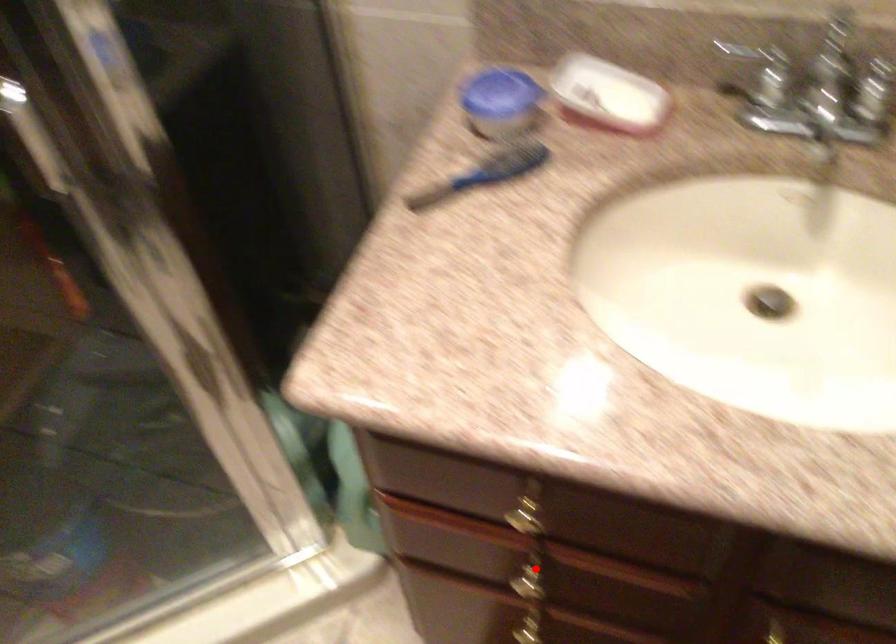
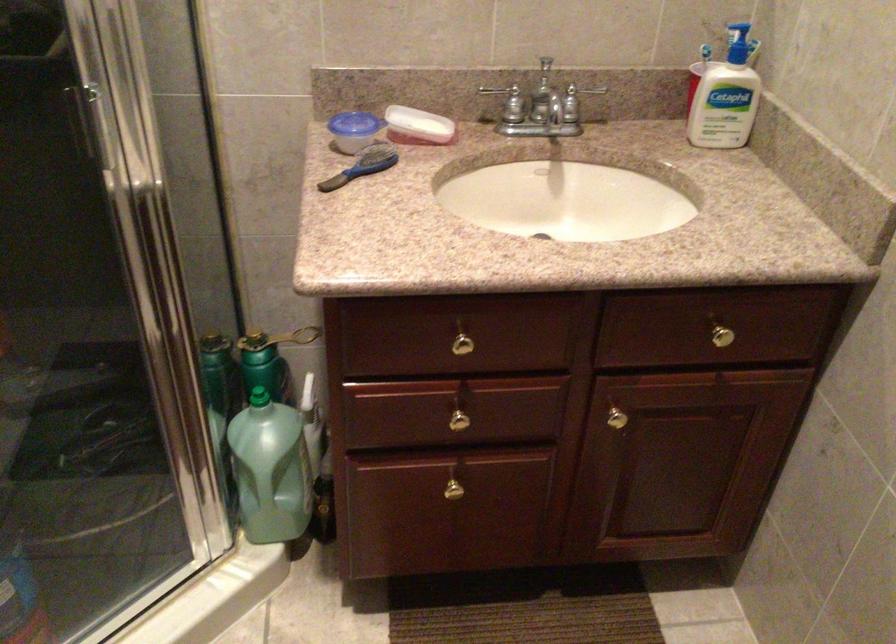
Find the pixel in the second image that matches the highlighted location in the first image.

(459, 415)